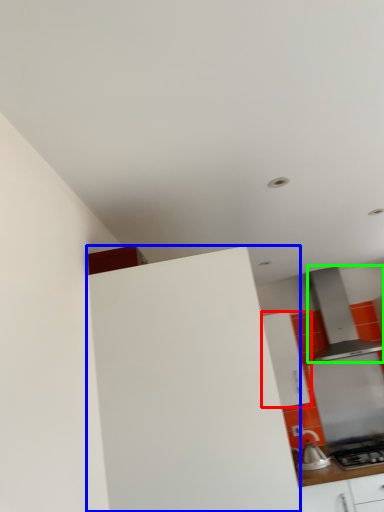
Question: Which object is positioned closest to cabinetry (highlighted by a red box)? Select from cabinetry (highlighted by a blue box) and home appliance (highlighted by a green box).

Choices:
 (A) cabinetry
 (B) home appliance

Answer: (B)